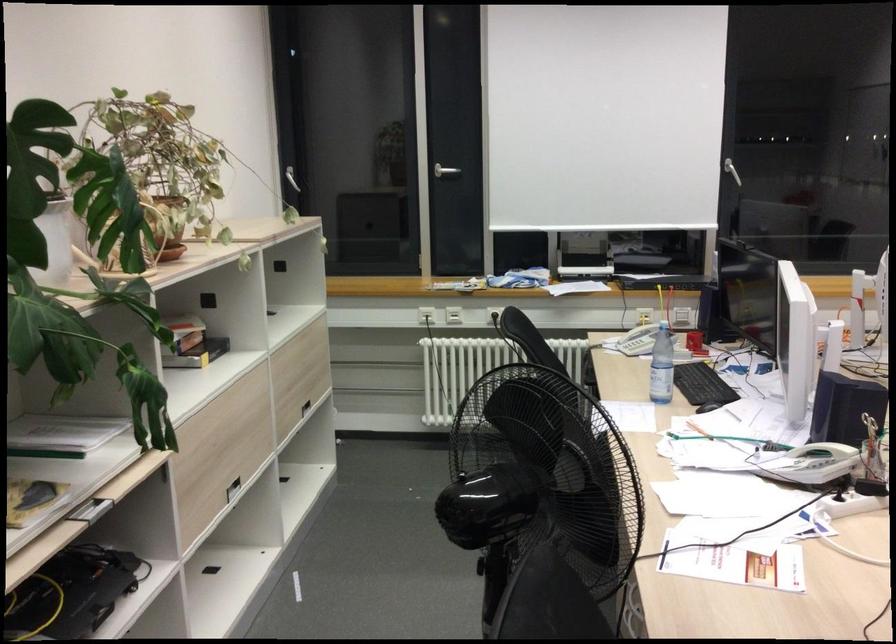
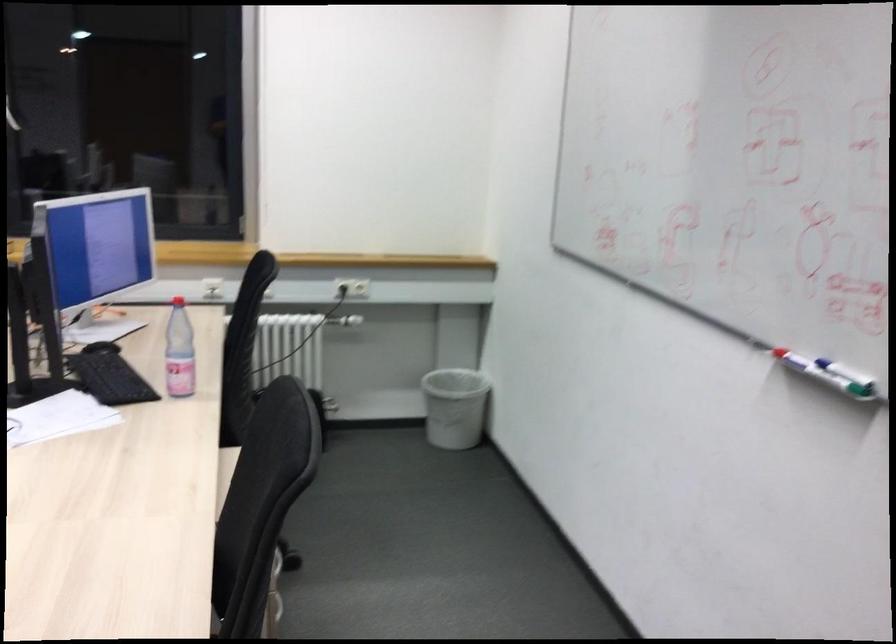
Question: What movement of the cameraman would produce the second image?

Choices:
 (A) Left
 (B) Right
 (C) Forward
 (D) Backward

Answer: (B)